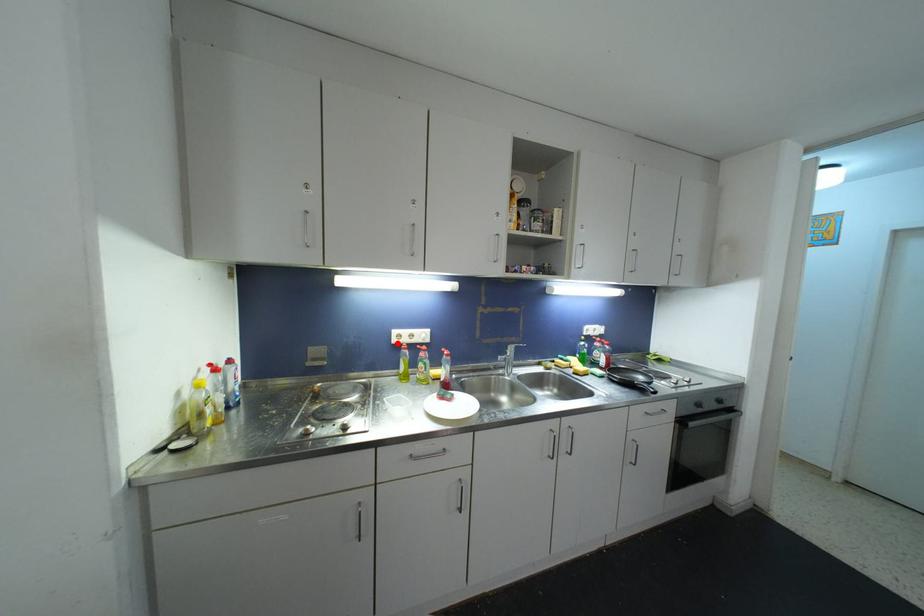
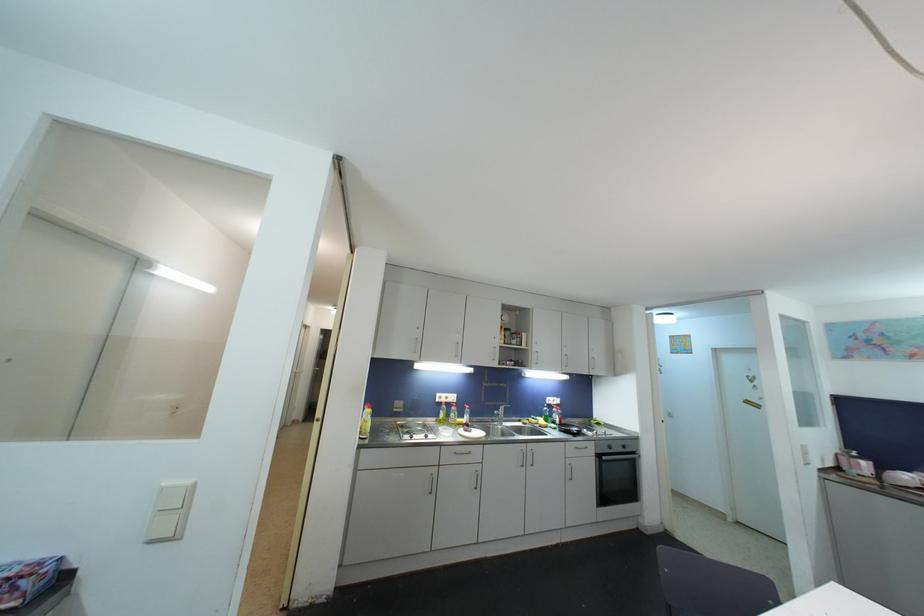
The point at the highlighted location is marked in the first image. Where is the corresponding point in the second image?

(441, 403)